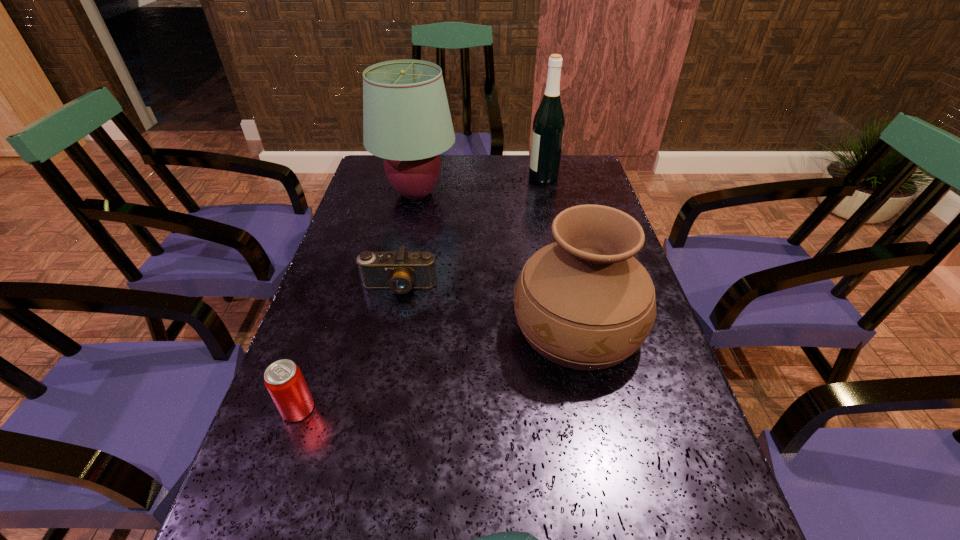
I want to click on wine bottle, so click(x=549, y=122).

At what (x,y) coordinates should I click in order to perform the action: click on lampshade. Please return your answer as a coordinate pair (x, y). Looking at the image, I should click on (406, 118).

The height and width of the screenshot is (540, 960). I want to click on the third tallest object, so click(x=584, y=302).

In order to click on can in this screenshot , I will do `click(283, 379)`.

At what (x,y) coordinates should I click in order to perform the action: click on the fourth tallest object. Please return your answer as a coordinate pair (x, y). This screenshot has width=960, height=540. Looking at the image, I should click on (283, 379).

At what (x,y) coordinates should I click in order to perform the action: click on camera. Please return your answer as a coordinate pair (x, y). Looking at the image, I should click on (401, 271).

This screenshot has height=540, width=960. Find the location of `free location located 0.290m on the label of the wine bottle`. free location located 0.290m on the label of the wine bottle is located at coordinates (443, 177).

What are the coordinates of `vacant space located 0.110m on the label of the wine bottle` in the screenshot? It's located at (496, 177).

Find the location of a particular element. vacant space positioned 0.260m on the label of the wine bottle is located at coordinates (451, 177).

Where is `free point located 0.300m on the right of the lampshade`? free point located 0.300m on the right of the lampshade is located at coordinates (552, 194).